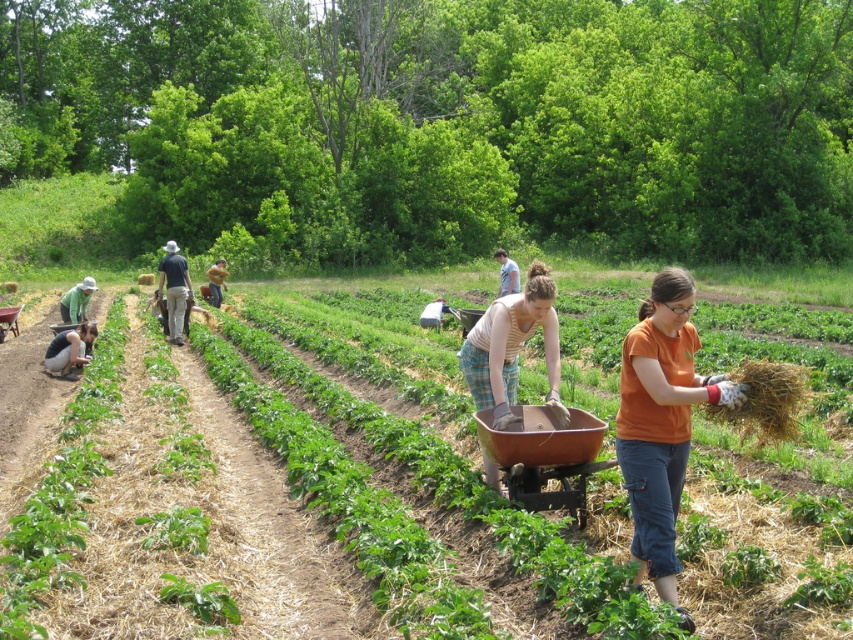
Question: Can you confirm if orange cotton shirt at center is thinner than striped cotton shirt at center?

Choices:
 (A) yes
 (B) no

Answer: (A)

Question: Which point is farther to the camera?

Choices:
 (A) (213, 282)
 (B) (512, 285)

Answer: (A)

Question: Which point is farther from the camera taking this photo?

Choices:
 (A) (215, 273)
 (B) (813, 618)
 (C) (503, 259)
 (D) (167, 332)

Answer: (A)

Question: Can you confirm if brown straw at lower right is wider than light blue shirt at center?

Choices:
 (A) yes
 (B) no

Answer: (B)

Question: Based on their relative distances, which object is farther from the green fabric shirt at left?

Choices:
 (A) striped cotton shirt at center
 (B) green plaid shirt at center
 (C) brown wooden wheelbarrow at center
 (D) brown straw at lower right

Answer: (D)

Question: Can you confirm if orange cotton shirt at center is positioned below green fabric at lower left?

Choices:
 (A) no
 (B) yes

Answer: (B)